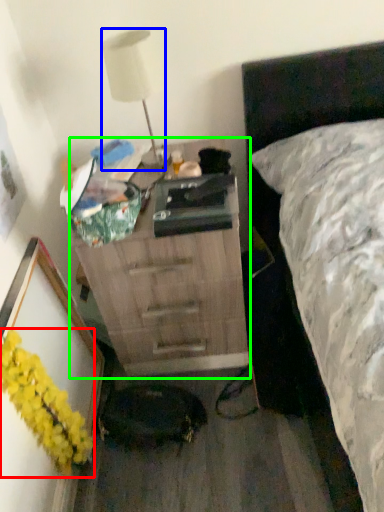
Question: Estimate the real-world distances between objects in this image. Which object is closer to flower (highlighted by a red box), lamp (highlighted by a blue box) or chest of drawers (highlighted by a green box)?

Choices:
 (A) lamp
 (B) chest of drawers

Answer: (B)